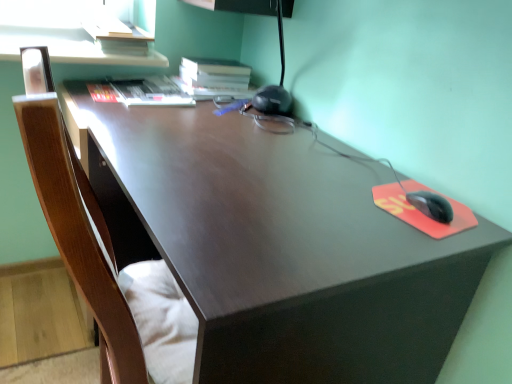
Describe the element at coordinates (214, 77) in the screenshot. I see `hardcover book at upper center, marked as the 1th book in a right-to-left arrangement` at that location.

This screenshot has height=384, width=512. What are the coordinates of `hardcover book at upper center, the second book viewed from the left` in the screenshot? It's located at (214, 77).

Is hardcover book at upper left, the first book viewed from the left, bigger or smaller than hardcover book at upper center, marked as the 1th book in a right-to-left arrangement?

In the image, hardcover book at upper left, the first book viewed from the left, appears to be smaller than hardcover book at upper center, marked as the 1th book in a right-to-left arrangement.

At what (x,y) coordinates should I click in order to perform the action: click on book in front of the hardcover book at upper center, marked as the 1th book in a right-to-left arrangement. Please return your answer as a coordinate pair (x, y). This screenshot has width=512, height=384. Looking at the image, I should click on (144, 92).

From the image's perspective, is hardcover book at upper left, the first book viewed from the left, under hardcover book at upper center, marked as the 1th book in a right-to-left arrangement?

Correct, hardcover book at upper left, the first book viewed from the left, appears lower than hardcover book at upper center, marked as the 1th book in a right-to-left arrangement, in the image.

Looking at their sizes, would you say hardcover book at upper center, the second book viewed from the left, is wider or thinner than matte brown desk at center?

hardcover book at upper center, the second book viewed from the left, is thinner than matte brown desk at center.

Does hardcover book at upper center, the second book viewed from the left, turn towards matte brown desk at center?

No, hardcover book at upper center, the second book viewed from the left, is not turned towards matte brown desk at center.

In the scene shown: From a real-world perspective, which object stands above the other?

From a 3D spatial view, hardcover book at upper center, the second book viewed from the left, is above.

Which of these two, hardcover book at upper center, the second book viewed from the left, or matte brown desk at center, stands shorter?

With less height is hardcover book at upper center, the second book viewed from the left.

How far apart are matte brown desk at center and hardcover book at upper left, the first book viewed from the left?

matte brown desk at center is 23.57 inches from hardcover book at upper left, the first book viewed from the left.

Is matte brown desk at center taller or shorter than hardcover book at upper left, the 2th book in the right-to-left sequence?

matte brown desk at center is taller than hardcover book at upper left, the 2th book in the right-to-left sequence.

Is matte brown desk at center in front of hardcover book at upper left, the first book viewed from the left?

Yes, matte brown desk at center is closer to the camera.

Considering the relative positions of hardcover book at upper left, the 2th book in the right-to-left sequence, and matte brown desk at center in the image provided, is hardcover book at upper left, the 2th book in the right-to-left sequence, behind matte brown desk at center?

Yes, hardcover book at upper left, the 2th book in the right-to-left sequence, is further from the camera.

Considering the relative positions of hardcover book at upper left, the first book viewed from the left, and matte brown desk at center in the image provided, is hardcover book at upper left, the first book viewed from the left, to the right of matte brown desk at center from the viewer's perspective?

No.

Is hardcover book at upper left, the 2th book in the right-to-left sequence, taller than matte brown desk at center?

No, hardcover book at upper left, the 2th book in the right-to-left sequence, is not taller than matte brown desk at center.

Is matte brown desk at center not inside hardcover book at upper center, the second book viewed from the left?

Yes, matte brown desk at center is outside of hardcover book at upper center, the second book viewed from the left.

Is matte brown desk at center smaller than hardcover book at upper center, marked as the 1th book in a right-to-left arrangement?

No, matte brown desk at center is not smaller than hardcover book at upper center, marked as the 1th book in a right-to-left arrangement.

Is matte brown desk at center oriented towards hardcover book at upper center, the second book viewed from the left?

No, matte brown desk at center is not oriented towards hardcover book at upper center, the second book viewed from the left.

Is point (185, 79) positioned after point (170, 105)?

That is True.

Which is more to the left, hardcover book at upper center, the second book viewed from the left, or hardcover book at upper left, the 2th book in the right-to-left sequence?

Positioned to the left is hardcover book at upper left, the 2th book in the right-to-left sequence.

Is hardcover book at upper center, marked as the 1th book in a right-to-left arrangement, situated inside hardcover book at upper left, the first book viewed from the left, or outside?

The correct answer is: outside.

What are the coordinates of `book above the hardcover book at upper left, the first book viewed from the left (from the image's perspective)` in the screenshot? It's located at (214, 77).

Find the location of a particular element. desk in front of the hardcover book at upper center, the second book viewed from the left is located at coordinates (286, 249).

Looking at the image, which one is located further to matte brown desk at center, hardcover book at upper center, marked as the 1th book in a right-to-left arrangement, or hardcover book at upper left, the 2th book in the right-to-left sequence?

Based on the image, hardcover book at upper center, marked as the 1th book in a right-to-left arrangement, appears to be further to matte brown desk at center.

Looking at the image, which one is located further to hardcover book at upper center, the second book viewed from the left, hardcover book at upper left, the 2th book in the right-to-left sequence, or matte brown desk at center?

matte brown desk at center is positioned further to the anchor hardcover book at upper center, the second book viewed from the left.

Looking at the image, which one is located further to hardcover book at upper left, the 2th book in the right-to-left sequence, matte brown desk at center or hardcover book at upper center, the second book viewed from the left?

The object further to hardcover book at upper left, the 2th book in the right-to-left sequence, is matte brown desk at center.

When comparing their distances from hardcover book at upper center, marked as the 1th book in a right-to-left arrangement, does matte brown desk at center or hardcover book at upper left, the 2th book in the right-to-left sequence, seem closer?

hardcover book at upper left, the 2th book in the right-to-left sequence, lies closer to hardcover book at upper center, marked as the 1th book in a right-to-left arrangement, than the other object.

Considering their positions, is hardcover book at upper center, the second book viewed from the left, positioned closer to hardcover book at upper left, the first book viewed from the left, than matte brown desk at center?

The object closer to hardcover book at upper left, the first book viewed from the left, is hardcover book at upper center, the second book viewed from the left.

Estimate the real-world distances between objects in this image. Which object is closer to matte brown desk at center, hardcover book at upper left, the 2th book in the right-to-left sequence, or hardcover book at upper center, marked as the 1th book in a right-to-left arrangement?

hardcover book at upper left, the 2th book in the right-to-left sequence, is positioned closer to the anchor matte brown desk at center.

The height and width of the screenshot is (384, 512). What are the coordinates of `book between matte brown desk at center and hardcover book at upper center, the second book viewed from the left, along the z-axis` in the screenshot? It's located at (144, 92).